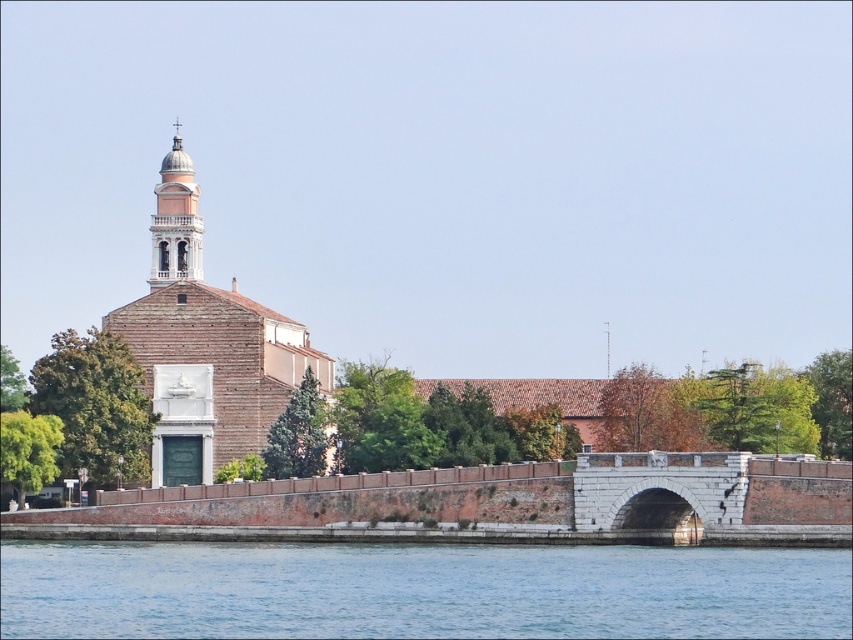
Question: Does white stone bridge at center have a lesser width compared to light pink stone bell tower at upper left?

Choices:
 (A) yes
 (B) no

Answer: (B)

Question: Which point is farther from the camera taking this photo?

Choices:
 (A) (265, 360)
 (B) (167, 227)
 (C) (126, 627)

Answer: (B)

Question: Does light brown brick church at left lie in front of white stone bridge at center?

Choices:
 (A) yes
 (B) no

Answer: (B)

Question: Which point is closer to the camera?

Choices:
 (A) light pink stone bell tower at upper left
 (B) blue water at lower center
 (C) light brown brick church at left

Answer: (B)

Question: Which object is closer to the camera taking this photo?

Choices:
 (A) white stone bridge at center
 (B) light brown brick church at left
 (C) blue water at lower center
 (D) light pink stone bell tower at upper left

Answer: (C)

Question: Is blue water at lower center below light pink stone bell tower at upper left?

Choices:
 (A) no
 (B) yes

Answer: (B)